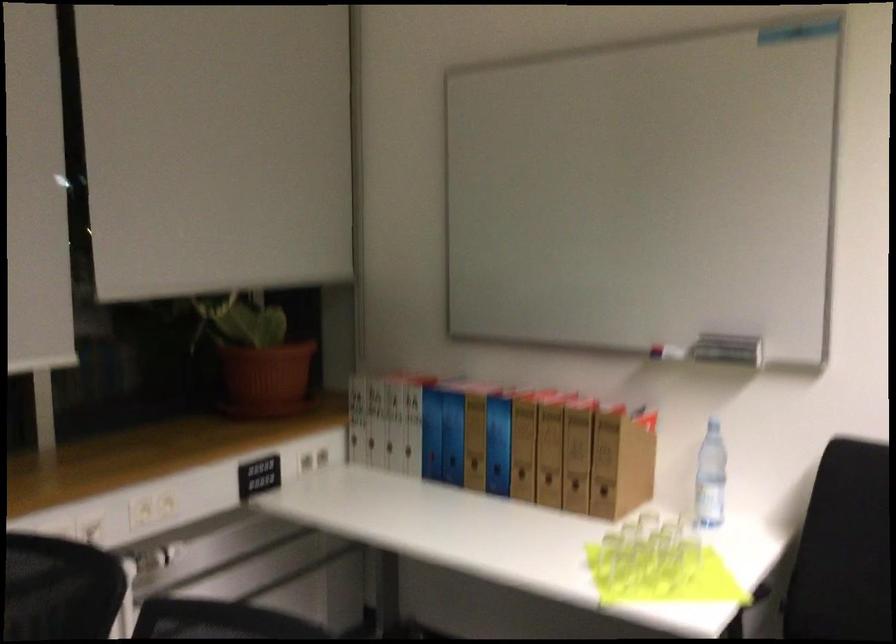
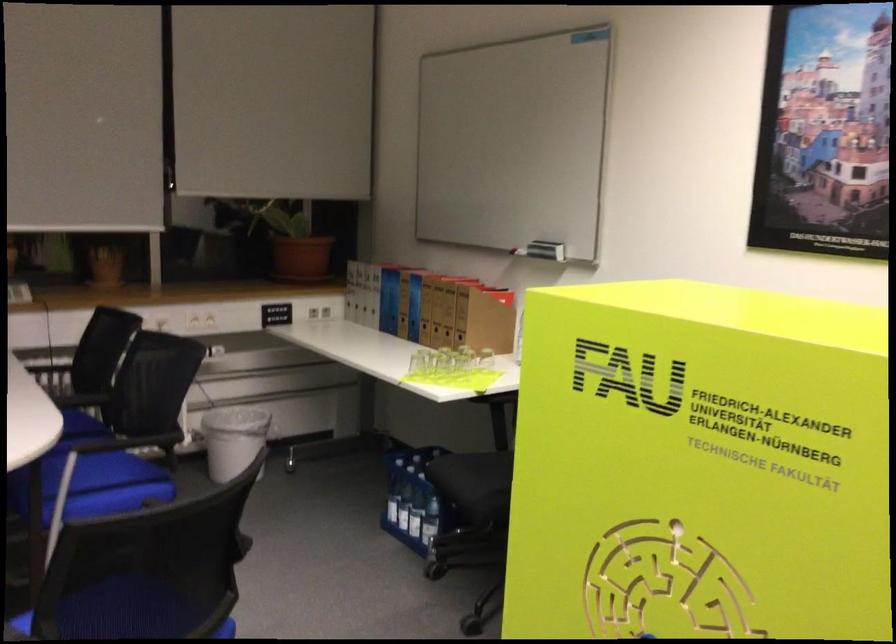
Where in the second image is the point corresponding to (263,360) from the first image?

(294, 243)